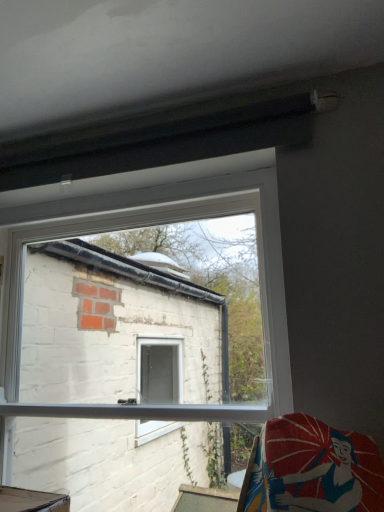
What do you see at coordinates (140, 337) in the screenshot? I see `white plastic window at center` at bounding box center [140, 337].

You are a GUI agent. You are given a task and a screenshot of the screen. Output one action in this format:
    pyautogui.click(x=<x>, y=<y>)
    Task: Click on the white plastic window at center
    
    Given the screenshot: What is the action you would take?
    pyautogui.click(x=140, y=337)

You are a GUI agent. You are given a task and a screenshot of the screen. Output one action in this format:
    pyautogui.click(x=<x>, y=<y>)
    Task: Click on the white plastic window at center
    
    Given the screenshot: What is the action you would take?
    pyautogui.click(x=140, y=337)